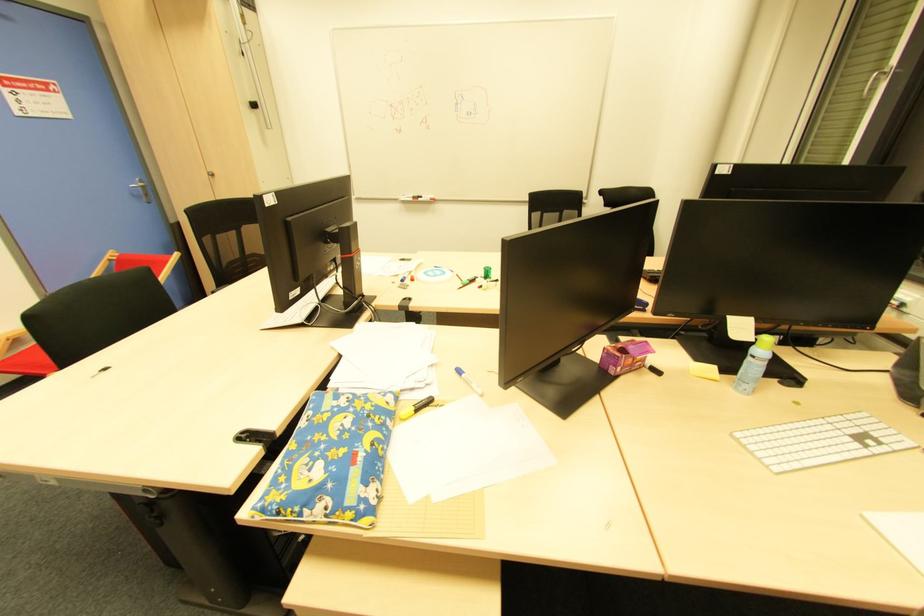
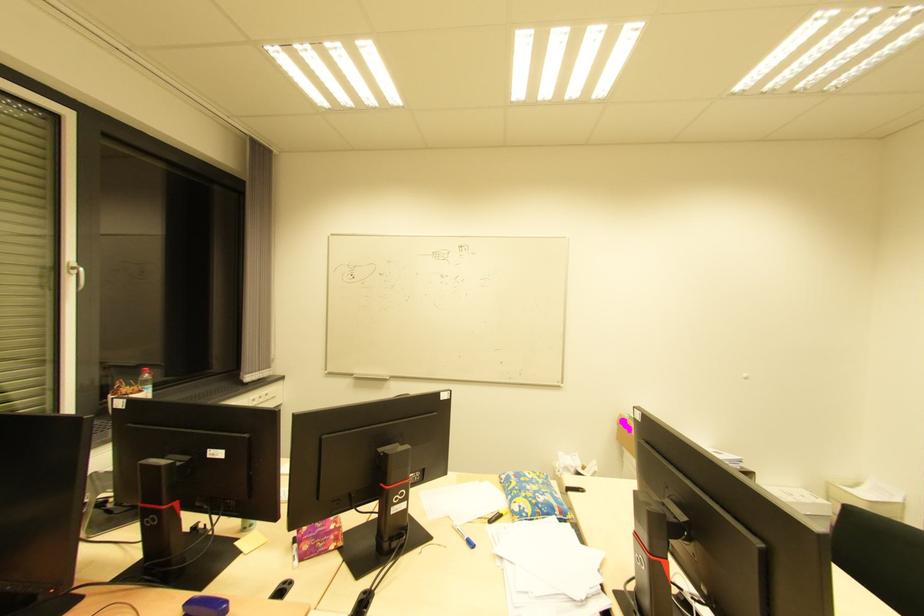
The point at (459, 373) is marked in the first image. Where is the corresponding point in the second image?

(470, 546)